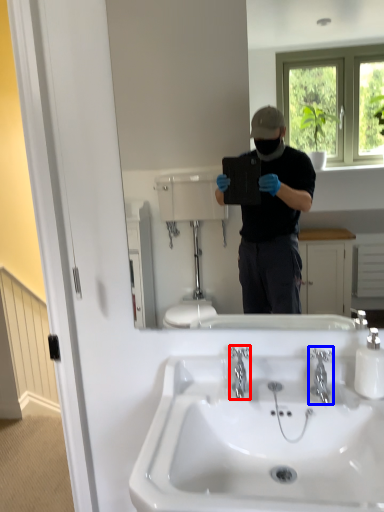
Question: Which object appears closest to the camera in this image, plumbing fixture (highlighted by a red box) or plumbing fixture (highlighted by a blue box)?

Choices:
 (A) plumbing fixture
 (B) plumbing fixture

Answer: (B)